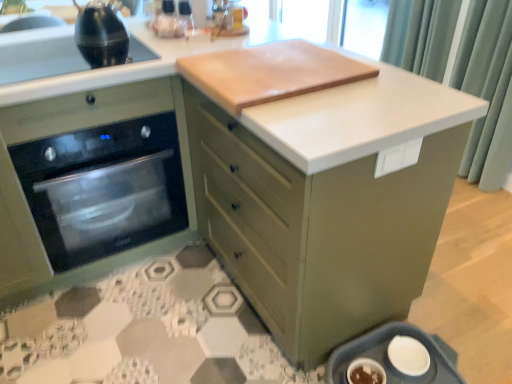
Question: Is black glass sink at upper left behind black glass oven at left?

Choices:
 (A) no
 (B) yes

Answer: (A)

Question: From a real-world perspective, is black glass sink at upper left on top of black glass oven at left?

Choices:
 (A) no
 (B) yes

Answer: (B)

Question: From the image's perspective, is black glass sink at upper left under black glass oven at left?

Choices:
 (A) no
 (B) yes

Answer: (A)

Question: From the image's perspective, does black glass sink at upper left appear higher than black glass oven at left?

Choices:
 (A) yes
 (B) no

Answer: (A)

Question: Is black glass oven at left located within black glass sink at upper left?

Choices:
 (A) no
 (B) yes

Answer: (A)

Question: Is green fabric curtain at upper right inside or outside of matte green cabinet at center?

Choices:
 (A) outside
 (B) inside

Answer: (A)

Question: Relative to matte green cabinet at center, is green fabric curtain at upper right in front or behind?

Choices:
 (A) behind
 (B) front

Answer: (A)

Question: Is green fabric curtain at upper right taller or shorter than matte green cabinet at center?

Choices:
 (A) short
 (B) tall

Answer: (B)

Question: From the image's perspective, is green fabric curtain at upper right above or below matte green cabinet at center?

Choices:
 (A) above
 (B) below

Answer: (A)

Question: In the image, is matte green trash can at lower right positioned in front of or behind green fabric curtain at upper right?

Choices:
 (A) front
 (B) behind

Answer: (A)

Question: Considering the positions of matte green trash can at lower right and green fabric curtain at upper right in the image, is matte green trash can at lower right wider or thinner than green fabric curtain at upper right?

Choices:
 (A) wide
 (B) thin

Answer: (A)

Question: Is matte green trash can at lower right inside or outside of green fabric curtain at upper right?

Choices:
 (A) inside
 (B) outside

Answer: (B)

Question: From the image's perspective, is matte green trash can at lower right positioned above or below green fabric curtain at upper right?

Choices:
 (A) above
 (B) below

Answer: (B)

Question: From the image's perspective, is black glass oven at left located above or below black glass sink at upper left?

Choices:
 (A) above
 (B) below

Answer: (B)

Question: Visually, is black glass oven at left positioned to the left or to the right of black glass sink at upper left?

Choices:
 (A) right
 (B) left

Answer: (B)